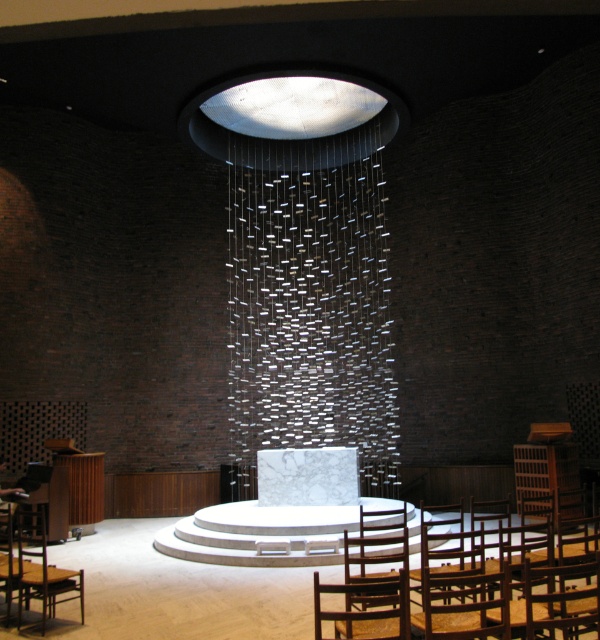
Is wooden textured chair at lower right bigger than wooden chair at lower right?

Yes.

Is wooden textured chair at lower right to the right of wooden chair at lower right from the viewer's perspective?

Yes, wooden textured chair at lower right is to the right of wooden chair at lower right.

Does point (400, 600) come in front of point (349, 609)?

That is True.

Where is `wooden textured chair at lower right`? wooden textured chair at lower right is located at coordinates point(364,609).

Does wooden chair at lower right have a greater width compared to wooden chair at lower center?

Correct, the width of wooden chair at lower right exceeds that of wooden chair at lower center.

Is wooden chair at lower right below wooden chair at lower center?

Indeed, wooden chair at lower right is positioned under wooden chair at lower center.

The image size is (600, 640). I want to click on wooden chair at lower right, so click(376, 547).

Does point (349, 632) lie in front of point (43, 532)?

Yes, it is in front of point (43, 532).

Locate an element on the screen. wooden textured chair at lower right is located at coordinates (364, 609).

The image size is (600, 640). I want to click on wooden textured chair at lower right, so click(364, 609).